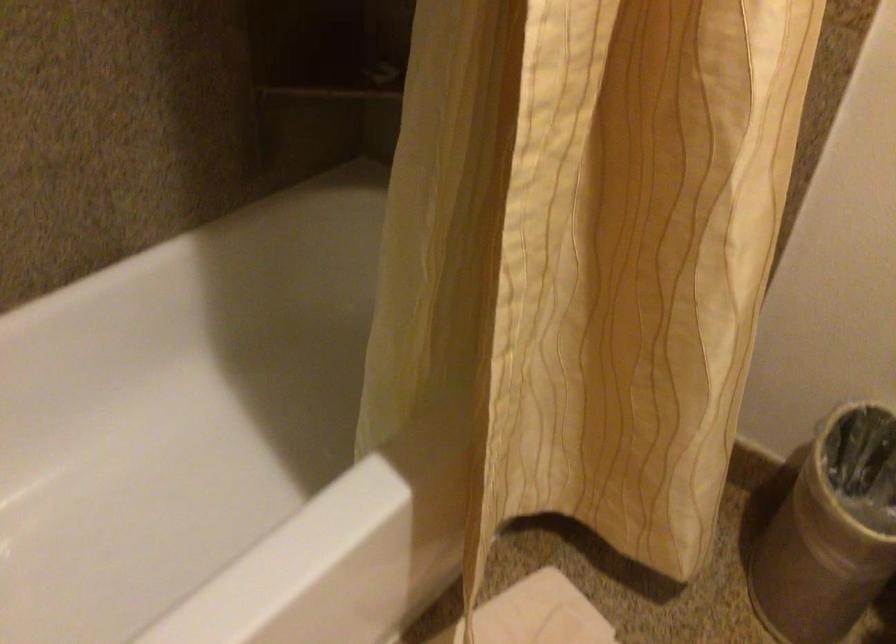
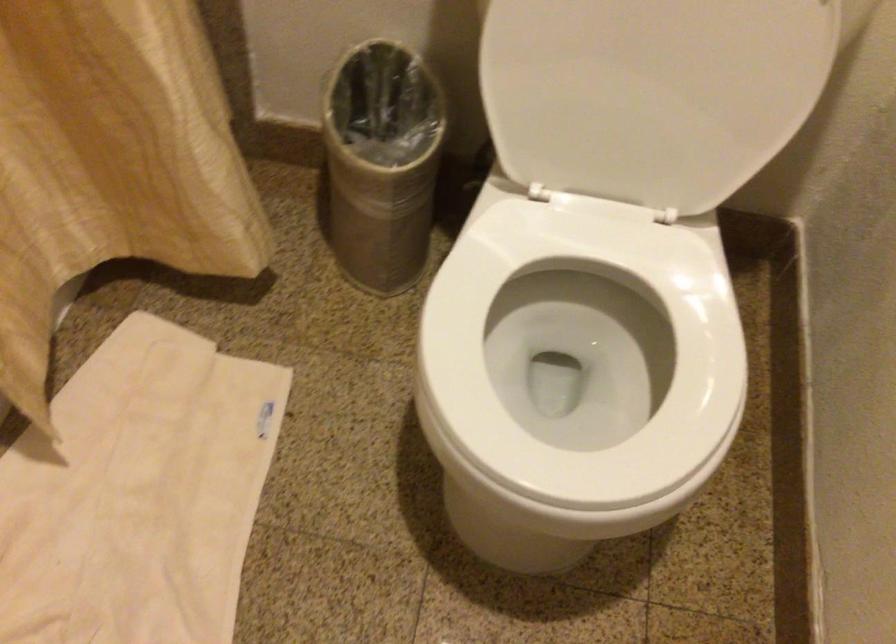
The images are taken continuously from a first-person perspective. In which direction is your viewpoint rotating?

The camera's rotation is toward right-down.